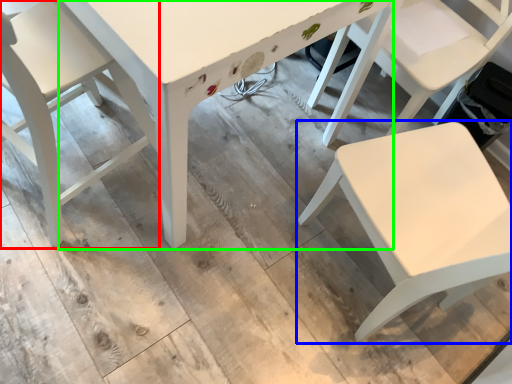
Question: Which is nearer to the chair (highlighted by a red box)? chair (highlighted by a blue box) or table (highlighted by a green box).

Choices:
 (A) chair
 (B) table

Answer: (B)